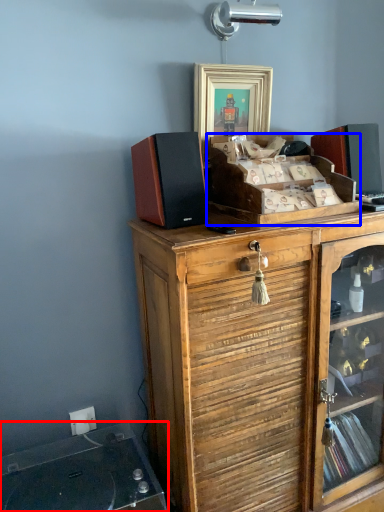
Question: Among these objects, which one is farthest to the camera, wide (highlighted by a red box) or cabinetry (highlighted by a blue box)?

Choices:
 (A) wide
 (B) cabinetry

Answer: (B)